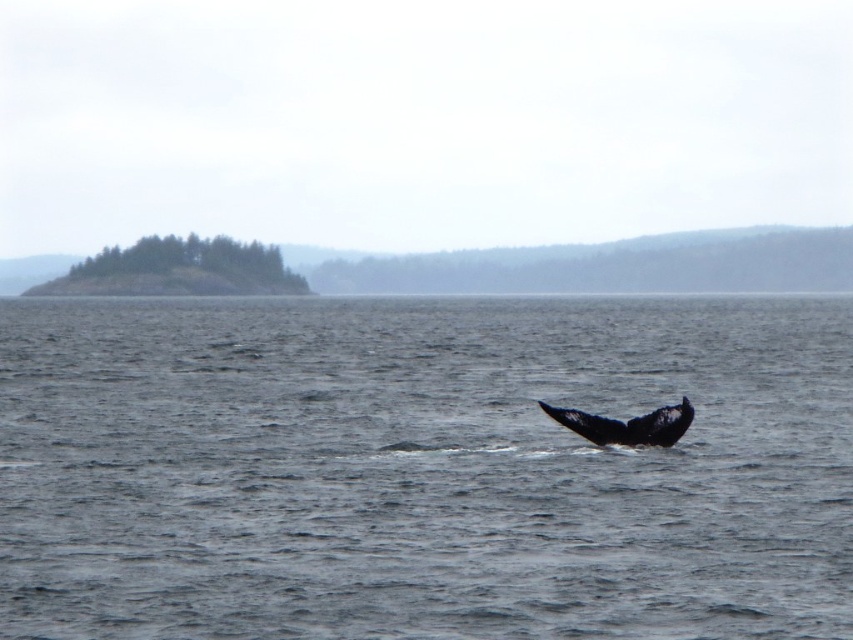
You are a sailor navigating a small boat on the water in the image. You notice a point marked at coordinates (422, 468). What is the location of this point relative to the dark gray water at center?

The point marked at coordinates (422, 468) is located at the dark gray water at center.

Consider the image. You are a marine biologist observing the scene. You notice the dark gray water at center and the black matte whale tail at lower right. Which object is positioned to the left of the other?

The dark gray water at center is to the left of black matte whale tail at lower right.

You are a marine biologist observing the scene. You notice the dark gray water at center and the black matte whale tail at lower right. Which object is positioned higher in the image?

The dark gray water at center is located above the black matte whale tail at lower right, so it is positioned higher in the image.